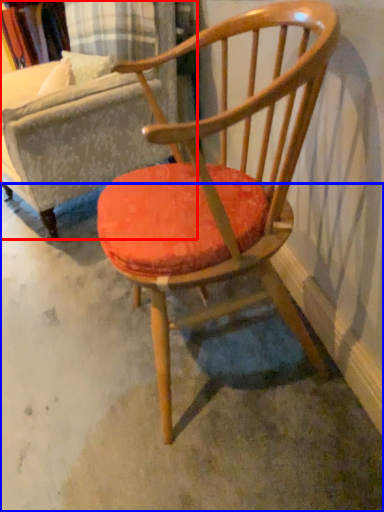
Question: Which of the following is the farthest to the observer, swivel chair (highlighted by a red box) or concrete (highlighted by a blue box)?

Choices:
 (A) swivel chair
 (B) concrete

Answer: (A)